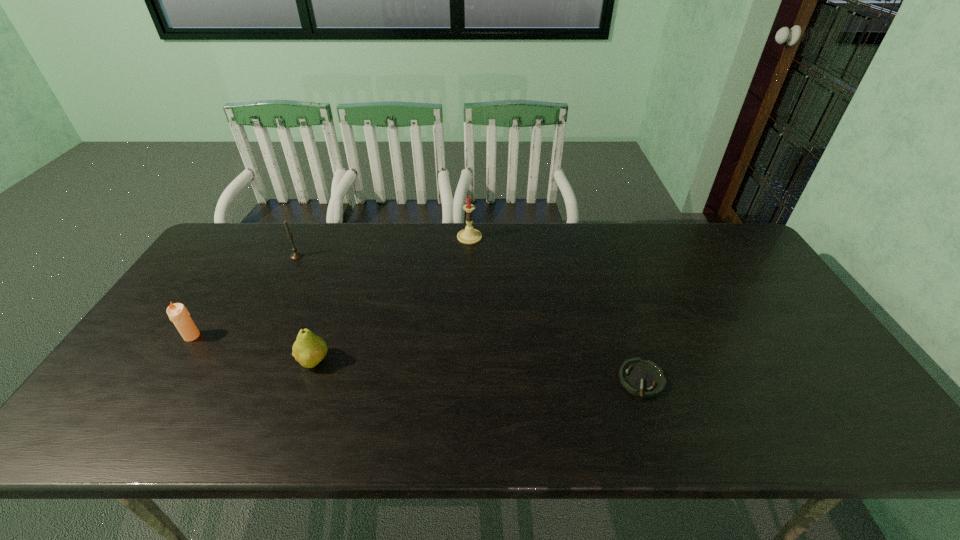
Identify the location of free space between the third nearest object and the fourth object from right to left. The width and height of the screenshot is (960, 540). coord(245,296).

Where is `object that is the nearest to the second farthest candle`? The width and height of the screenshot is (960, 540). object that is the nearest to the second farthest candle is located at coordinates [x=178, y=314].

The image size is (960, 540). Identify the location of object that is the closest to the third object from left to right. (178, 314).

Point out which candle is positioned as the second nearest to the second farthest object. Please provide its 2D coordinates. Your answer should be formatted as a tuple, i.e. [(x, y)], where the tuple contains the x and y coordinates of a point satisfying the conditions above.

[(469, 235)]

Point out which candle is positioned as the third nearest to the ashtray. Please provide its 2D coordinates. Your answer should be formatted as a tuple, i.e. [(x, y)], where the tuple contains the x and y coordinates of a point satisfying the conditions above.

[(178, 314)]

This screenshot has width=960, height=540. In order to click on vacant space that satisfies the following two spatial constraints: 1. on the back side of the rightmost candle; 2. on the left side of the third object from left to right in this screenshot , I will do `click(357, 237)`.